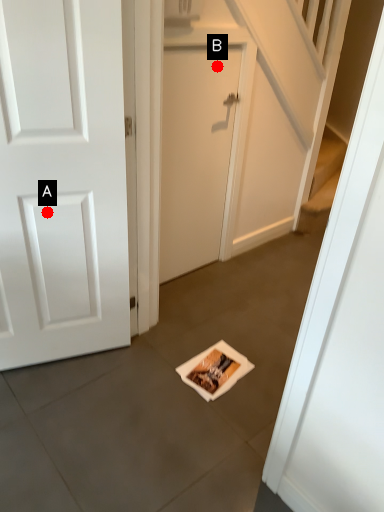
Question: Two points are circled on the image, labeled by A and B beside each circle. Which of the following is the farthest from the observer?

Choices:
 (A) A is further
 (B) B is further

Answer: (B)